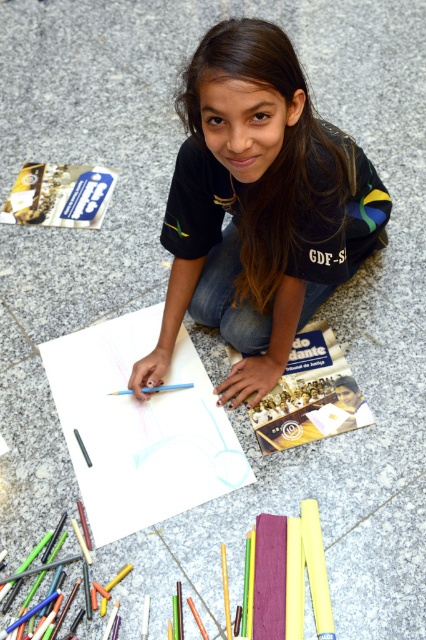
Question: Can you confirm if matte black shirt at center is positioned below white paper at center?

Choices:
 (A) yes
 (B) no

Answer: (B)

Question: Which object appears farthest from the camera in this image?

Choices:
 (A) white paper at center
 (B) matte black shirt at center

Answer: (A)

Question: Does matte black shirt at center have a smaller size compared to white paper at center?

Choices:
 (A) no
 (B) yes

Answer: (A)

Question: Does matte black shirt at center appear on the right side of white paper at center?

Choices:
 (A) yes
 (B) no

Answer: (A)